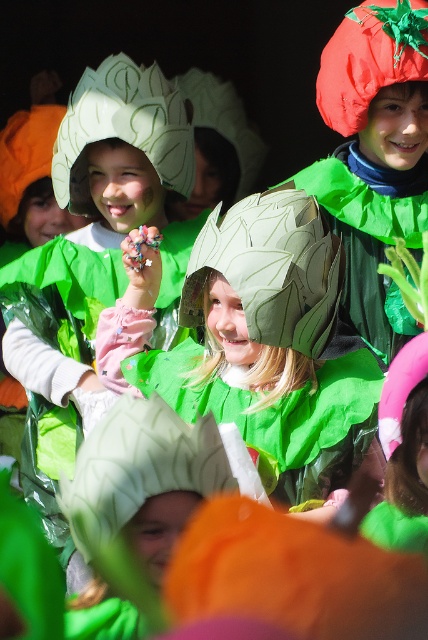
Question: Which point is closer to the camera?

Choices:
 (A) green paper headdress at upper center
 (B) matte green leaf at center
 (C) matte green leaf hat at center
 (D) matte green paper headdress at center

Answer: (B)

Question: Can you confirm if matte green paper headdress at center is positioned to the left of matte green leaf at center?

Choices:
 (A) yes
 (B) no

Answer: (B)

Question: From the image, what is the correct spatial relationship of green paper headdress at upper center in relation to rubberized red tomato at upper right?

Choices:
 (A) right
 (B) left

Answer: (B)

Question: Is green paper headdress at upper center to the right of rubberized red tomato at upper right from the viewer's perspective?

Choices:
 (A) yes
 (B) no

Answer: (B)

Question: Among these objects, which one is farthest from the camera?

Choices:
 (A) rubberized red tomato at upper right
 (B) matte green leaf hat at center
 (C) matte green leaf at center

Answer: (A)

Question: Which point is farther from the camera taking this photo?

Choices:
 (A) (341, 108)
 (B) (267, 323)
 (C) (309, 260)

Answer: (A)